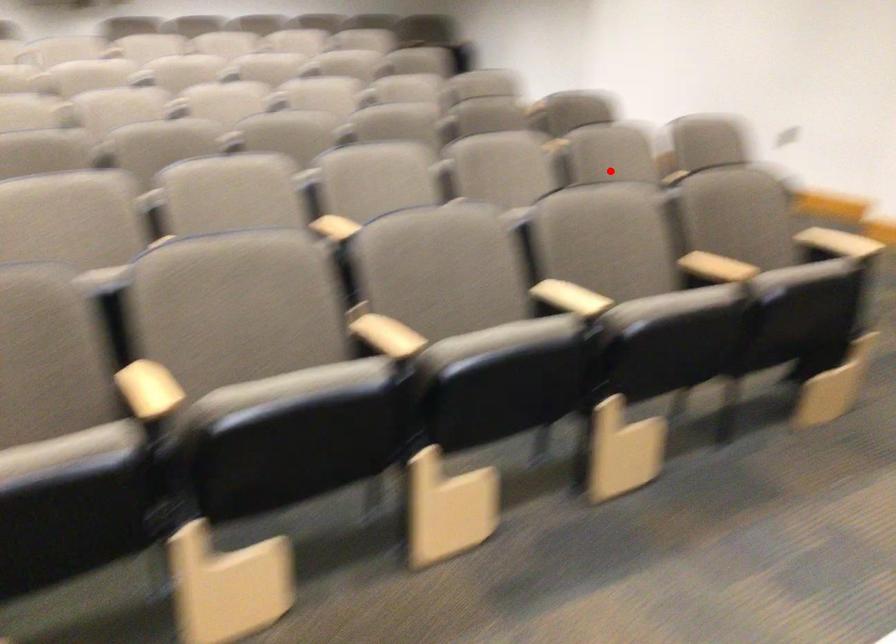
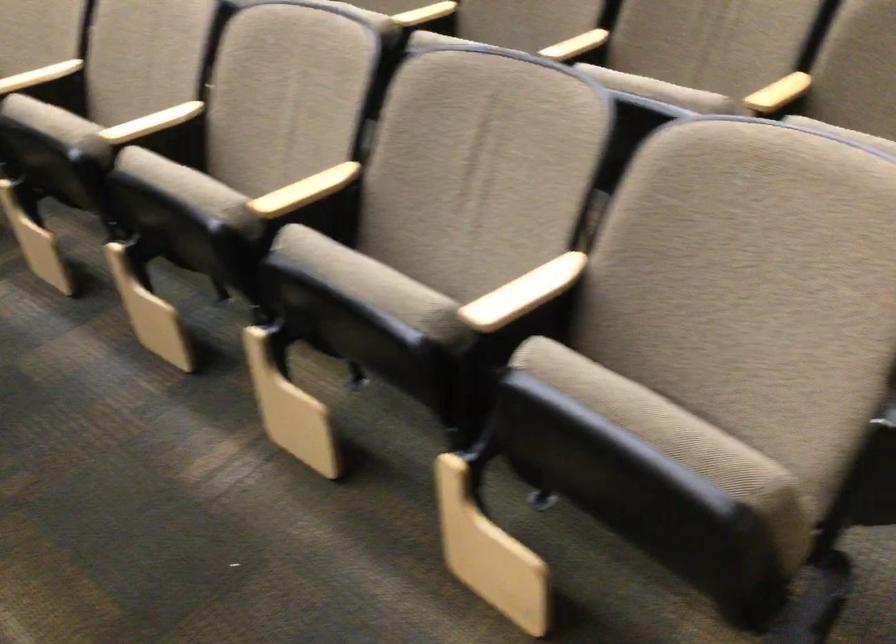
In the second image, find the point that corresponds to the highlighted location in the first image.

(305, 191)